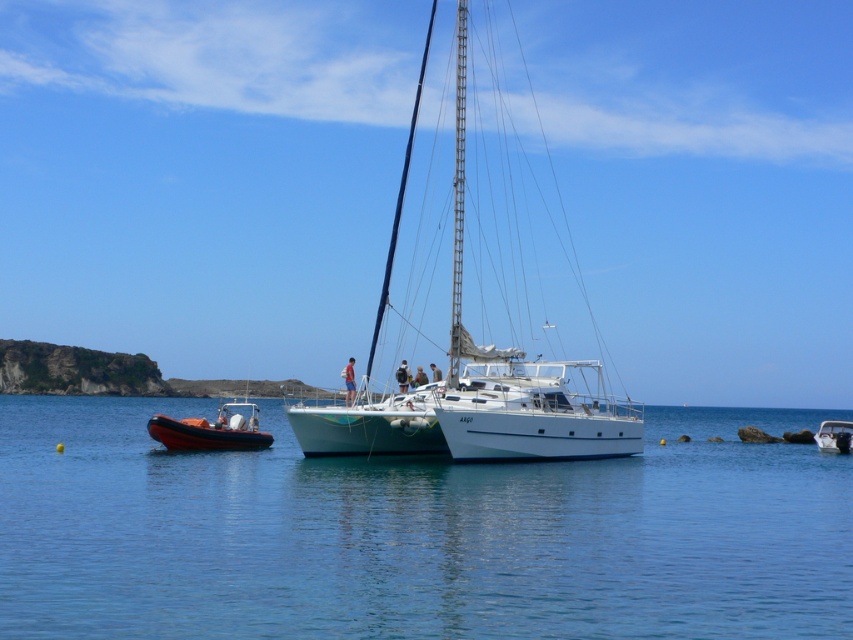
You are a photographer trying to capture a shot of the white glossy boat at center and the clear blue water at center. From your current position, which object is more to the left?

The clear blue water at center is positioned on the left side of white glossy boat at center, so the clear blue water at center is more to the left.

You are a photographer planning to capture the white glossy sailboat at center and the clear blue water at center in a single frame. Based on their positions, which object will appear closer to the right edge of your photo?

The clear blue water at center is positioned on the right side of white glossy sailboat at center, so it will appear closer to the right edge of the photo.

You are a sailor planning to dock your boat between the white glossy sailboat at center and the white glossy boat at center. Based on their positions, which boat should you approach first to ensure safe docking?

The white glossy sailboat at center is positioned over the white glossy boat at center, meaning the white glossy sailboat at center is closer to you. Approach the white glossy sailboat at center first for safe docking.